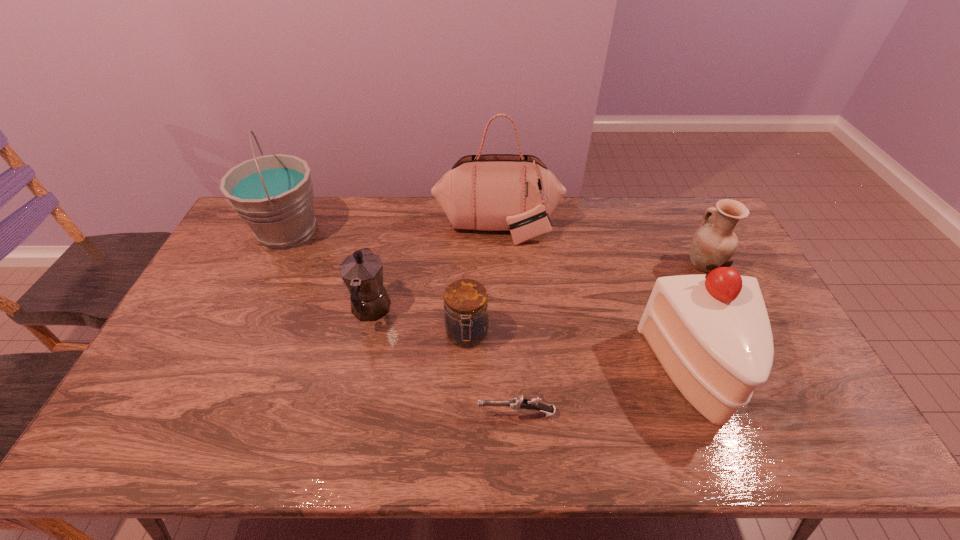
This screenshot has width=960, height=540. In order to click on handbag in this screenshot , I will do `click(493, 192)`.

Identify the location of bucket. (273, 194).

Where is `cake`? cake is located at coordinates (711, 333).

Where is `pottery`? This screenshot has height=540, width=960. pottery is located at coordinates (716, 243).

The height and width of the screenshot is (540, 960). Identify the location of coffeepot. point(362,272).

The image size is (960, 540). In order to click on the sixth tallest object in this screenshot , I will do `click(466, 319)`.

Identify the location of the shortest object. (519, 403).

The height and width of the screenshot is (540, 960). Find the location of `free space located 0.200m on the side of the handbag with the attached pouch`. free space located 0.200m on the side of the handbag with the attached pouch is located at coordinates (500, 288).

Find the location of a particular element. This screenshot has width=960, height=540. free location located 0.050m on the left of the bucket is located at coordinates (234, 231).

I want to click on vacant area situated on the front of the cake, so click(731, 454).